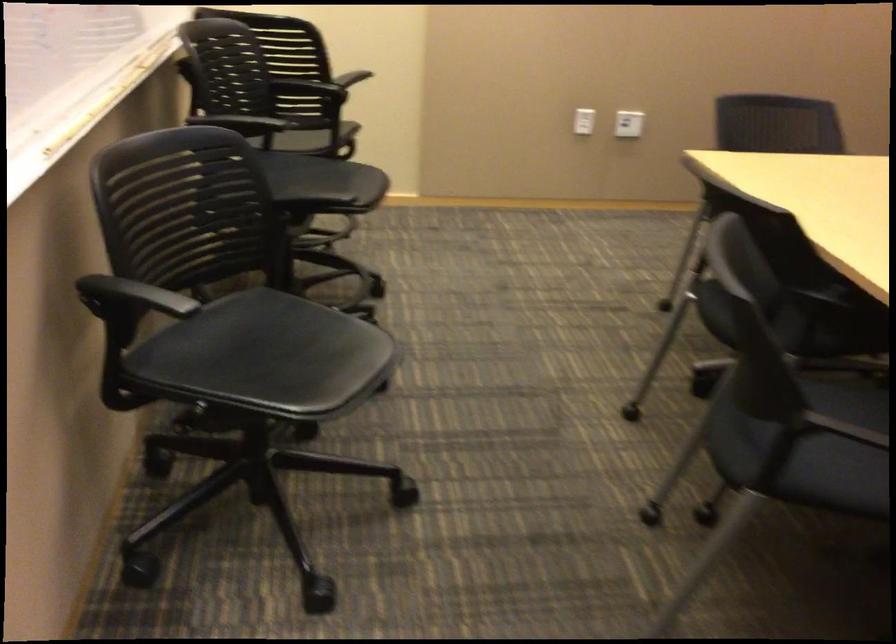
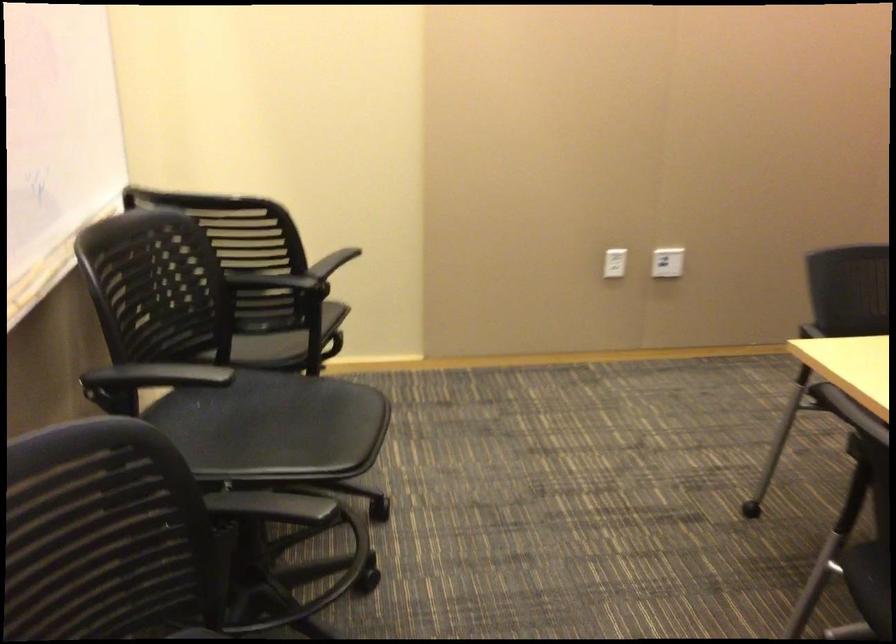
Where in the second image is the point corresponding to (588,120) from the first image?

(615, 263)